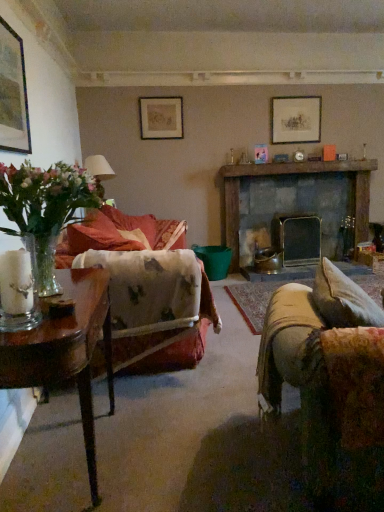
Question: Can you confirm if matte white lampshade at left is smaller than dark gray stone fireplace at center?

Choices:
 (A) no
 (B) yes

Answer: (B)

Question: Is matte white lampshade at left behind dark gray stone fireplace at center?

Choices:
 (A) yes
 (B) no

Answer: (B)

Question: Can you confirm if matte white lampshade at left is shorter than dark gray stone fireplace at center?

Choices:
 (A) yes
 (B) no

Answer: (A)

Question: Is matte white lampshade at left at the left side of dark gray stone fireplace at center?

Choices:
 (A) no
 (B) yes

Answer: (B)

Question: Considering the relative sizes of matte white lampshade at left and dark gray stone fireplace at center in the image provided, is matte white lampshade at left bigger than dark gray stone fireplace at center?

Choices:
 (A) yes
 (B) no

Answer: (B)

Question: Is matte white lampshade at left not inside dark gray stone fireplace at center?

Choices:
 (A) yes
 (B) no

Answer: (A)

Question: From the image's perspective, is matte gold picture frame at upper center, which is counted as the second picture frame, starting from the left, on top of matte white lampshade at left?

Choices:
 (A) no
 (B) yes

Answer: (B)

Question: Considering the relative sizes of matte gold picture frame at upper center, placed as the 2th picture frame when sorted from right to left, and matte white lampshade at left in the image provided, is matte gold picture frame at upper center, placed as the 2th picture frame when sorted from right to left, taller than matte white lampshade at left?

Choices:
 (A) yes
 (B) no

Answer: (B)

Question: Would you say matte gold picture frame at upper center, which is counted as the second picture frame, starting from the left, contains matte white lampshade at left?

Choices:
 (A) yes
 (B) no

Answer: (B)

Question: Can you confirm if matte gold picture frame at upper center, which is counted as the second picture frame, starting from the left, is positioned to the right of matte white lampshade at left?

Choices:
 (A) no
 (B) yes

Answer: (B)

Question: Is matte gold picture frame at upper center, which is counted as the second picture frame, starting from the front, bigger than matte white lampshade at left?

Choices:
 (A) yes
 (B) no

Answer: (B)

Question: From a real-world perspective, is matte gold picture frame at upper center, placed as the 2th picture frame when sorted from right to left, physically above matte white lampshade at left?

Choices:
 (A) no
 (B) yes

Answer: (B)

Question: Considering the relative positions of clear glass vase at left and matte black picture frame at upper left, which is counted as the 3th picture frame, starting from the right, in the image provided, is clear glass vase at left in front of matte black picture frame at upper left, which is counted as the 3th picture frame, starting from the right,?

Choices:
 (A) no
 (B) yes

Answer: (B)